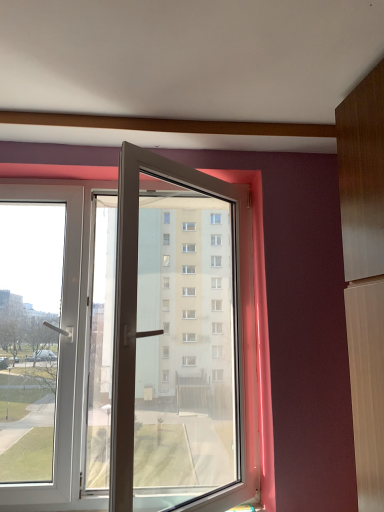
In order to click on white plastic window at center in this screenshot , I will do `click(248, 364)`.

What do you see at coordinates (248, 364) in the screenshot? I see `white plastic window at center` at bounding box center [248, 364].

At what (x,y) coordinates should I click in order to perform the action: click on white plastic window at center. Please return your answer as a coordinate pair (x, y). This screenshot has width=384, height=512. Looking at the image, I should click on (x=248, y=364).